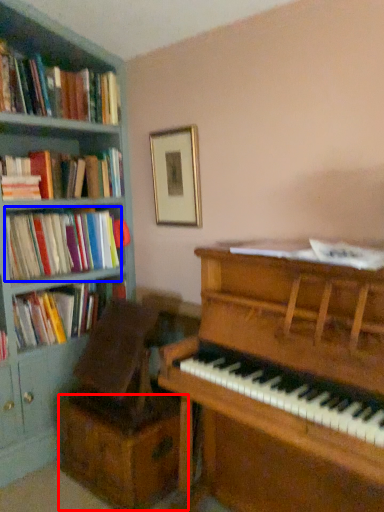
Question: Which object appears closest to the camera in this image, drawer (highlighted by a red box) or book (highlighted by a blue box)?

Choices:
 (A) drawer
 (B) book

Answer: (A)